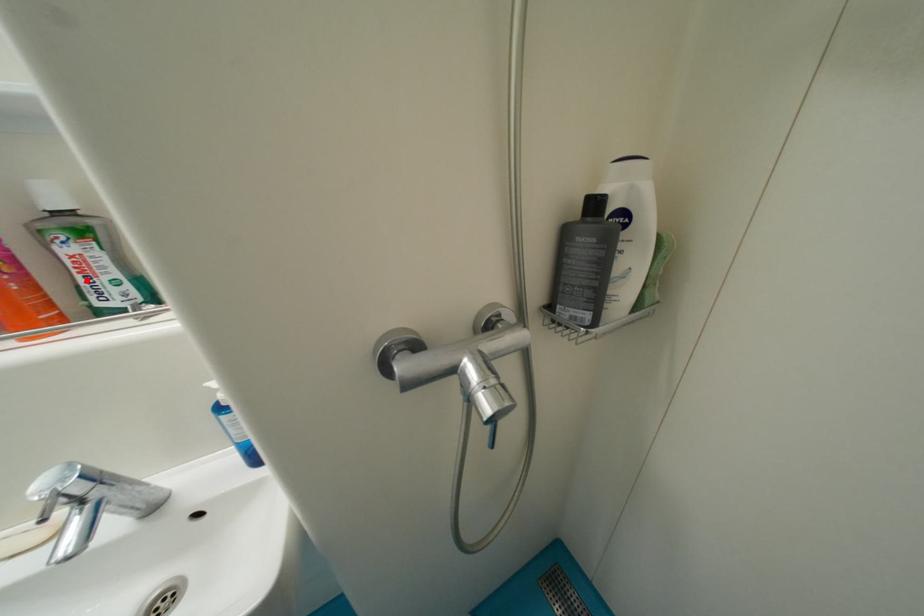
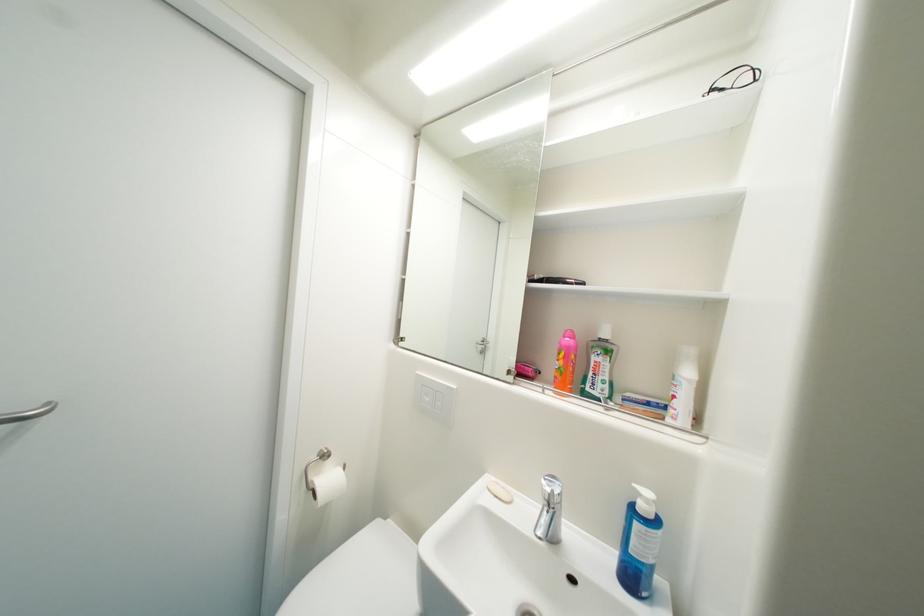
Locate, in the second image, the point that corresponds to the highlighted location in the first image.

(598, 376)